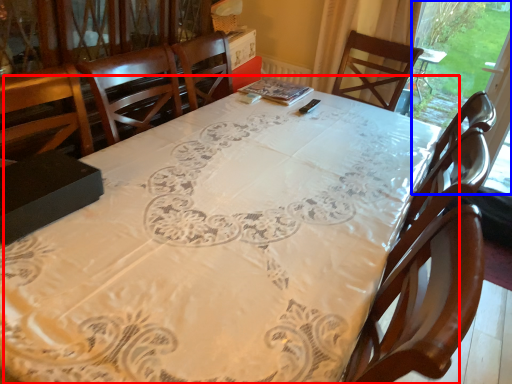
Question: Which object appears farthest to the camera in this image, table (highlighted by a red box) or window screen (highlighted by a blue box)?

Choices:
 (A) table
 (B) window screen

Answer: (B)